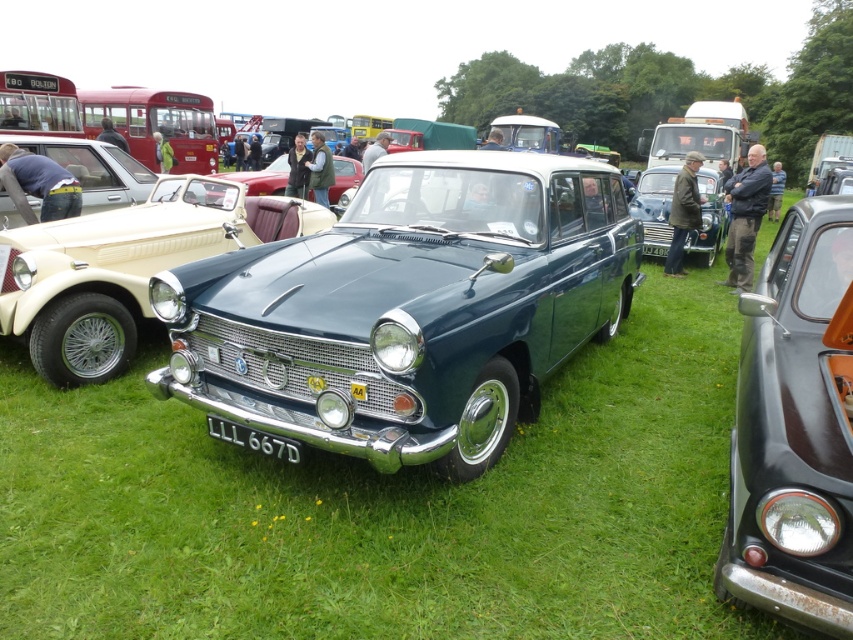
Identify the location of shiny blue car at center. This screenshot has width=853, height=640. (126, 268).

How much distance is there between shiny blue car at center and black metallic license plate at center?

A distance of 8.16 feet exists between shiny blue car at center and black metallic license plate at center.

Does point (271, 196) come in front of point (271, 440)?

No, it is not.

This screenshot has width=853, height=640. In order to click on shiny blue car at center in this screenshot , I will do `click(126, 268)`.

Who is higher up, black metallic license plate at center or black plastic license plate at center?

black plastic license plate at center is higher up.

Between black metallic license plate at center and black plastic license plate at center, which one appears on the right side from the viewer's perspective?

From the viewer's perspective, black plastic license plate at center appears more on the right side.

Which is behind, point (297, 452) or point (654, 253)?

The point (654, 253) is behind.

At what (x,y) coordinates should I click in order to perform the action: click on black metallic license plate at center. Please return your answer as a coordinate pair (x, y). This screenshot has width=853, height=640. Looking at the image, I should click on (254, 440).

Measure the distance between teal metallic sedan at center and metallic red car at center.

The distance of teal metallic sedan at center from metallic red car at center is 26.27 feet.

Measure the distance between point (257, 371) and camera.

Point (257, 371) and camera are 10.78 feet apart from each other.

You are a GUI agent. You are given a task and a screenshot of the screen. Output one action in this format:
    pyautogui.click(x=<x>, y=<y>)
    Task: Click on the teal metallic sedan at center
    
    Given the screenshot: What is the action you would take?
    pyautogui.click(x=408, y=308)